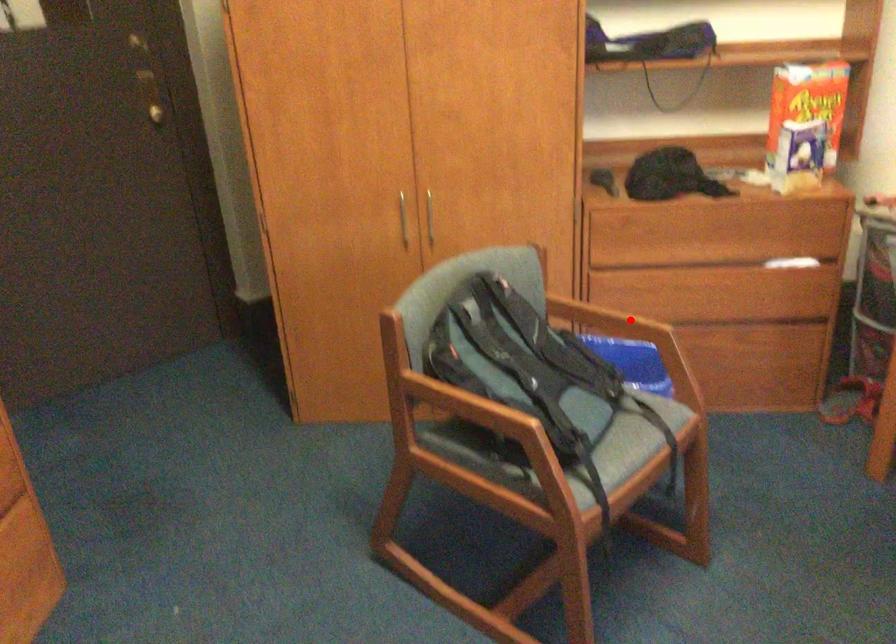
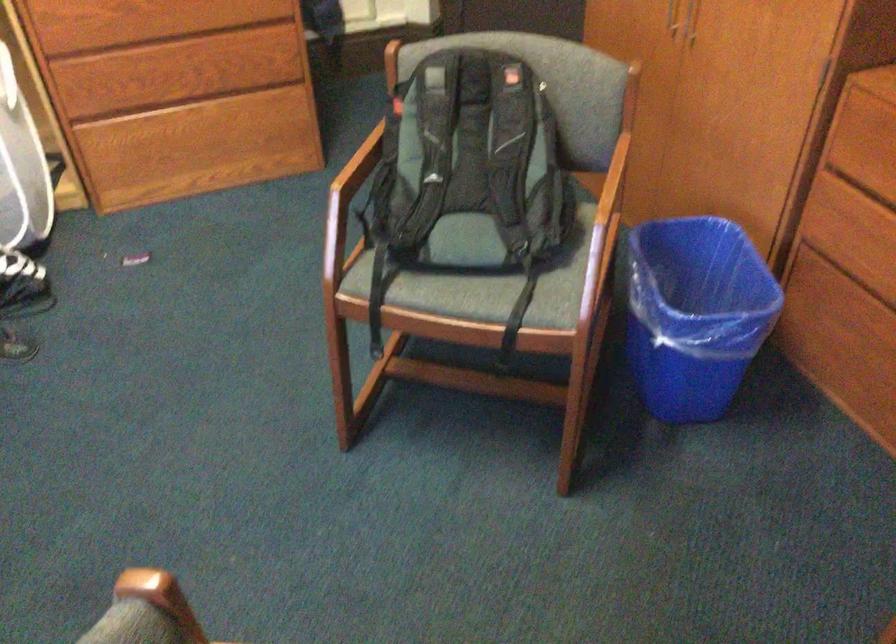
In the second image, find the point that corresponds to the highlighted location in the first image.

(609, 201)